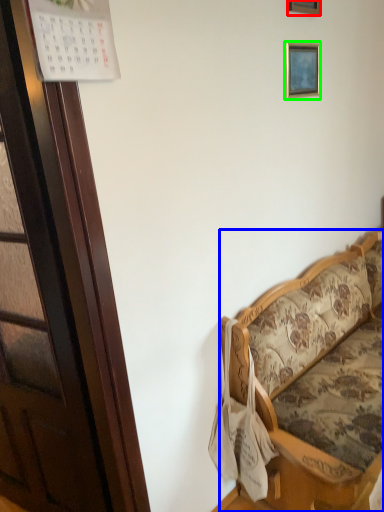
Question: Based on their relative distances, which object is nearer to picture frame (highlighted by a red box)? Choose from studio couch (highlighted by a blue box) and picture frame (highlighted by a green box).

Choices:
 (A) studio couch
 (B) picture frame

Answer: (B)